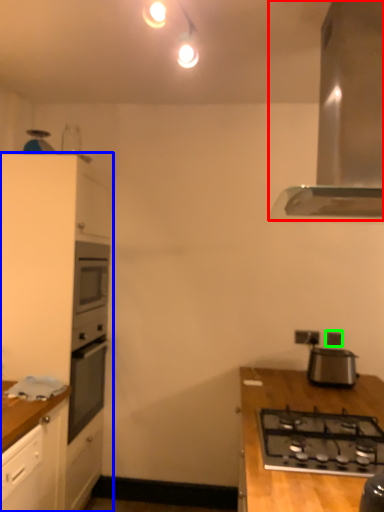
Question: Based on their relative distances, which object is nearer to home appliance (highlighted by a red box)? Choose from cabinetry (highlighted by a blue box) and electric outlet (highlighted by a green box).

Choices:
 (A) cabinetry
 (B) electric outlet

Answer: (B)